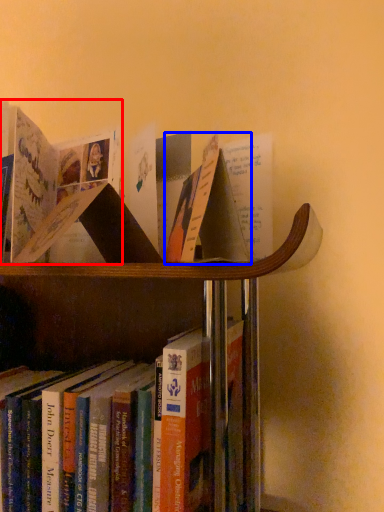
Question: Which object is closer to the camera taking this photo, book (highlighted by a red box) or paperback book (highlighted by a blue box)?

Choices:
 (A) book
 (B) paperback book

Answer: (B)